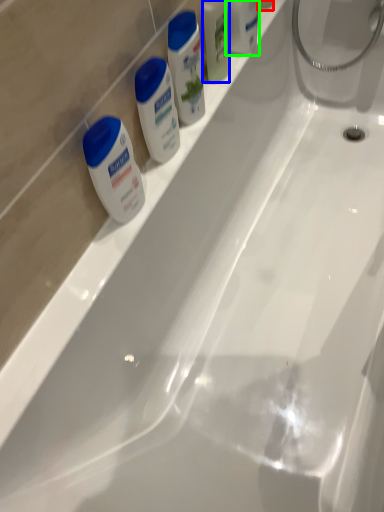
Question: Based on their relative distances, which object is farther from toiletry (highlighted by a red box)? Choose from mouthwash (highlighted by a blue box) and toiletry (highlighted by a green box).

Choices:
 (A) mouthwash
 (B) toiletry

Answer: (A)